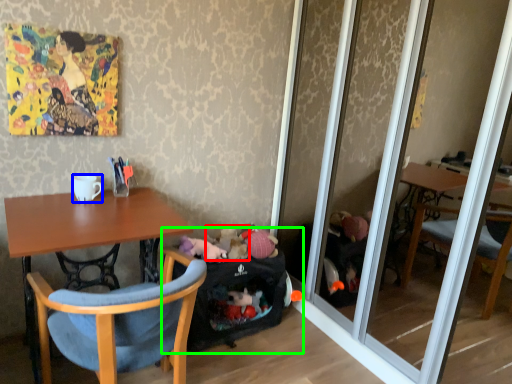
Question: Estimate the real-world distances between objects in this image. Which object is closer to toy (highlighted by a red box), coffee cup (highlighted by a blue box) or baby carriage (highlighted by a green box)?

Choices:
 (A) coffee cup
 (B) baby carriage

Answer: (B)